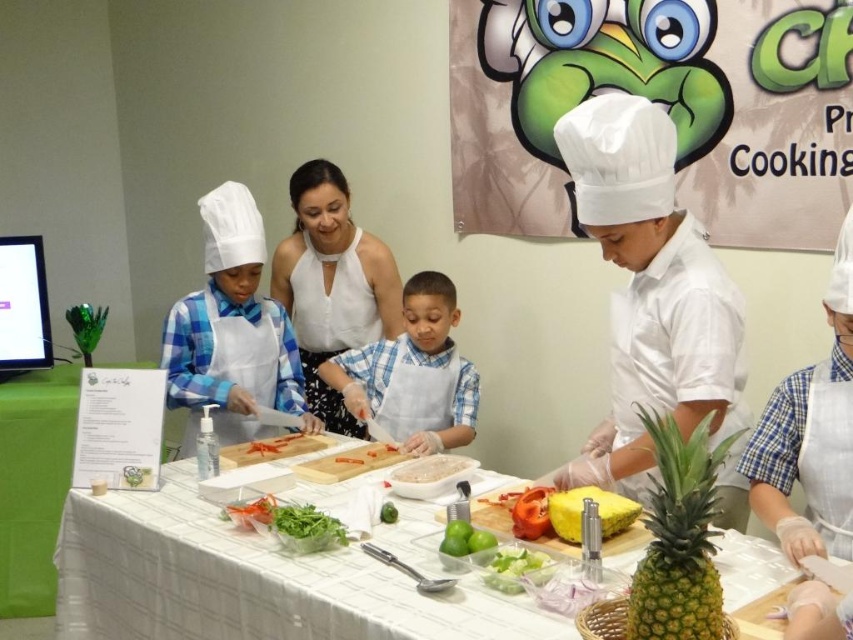
This screenshot has height=640, width=853. What are the coordinates of `white plastic table at center` in the screenshot? It's located at tap(247, 580).

Can you confirm if white plastic table at center is bigger than green textured pineapple at center?

Indeed, white plastic table at center has a larger size compared to green textured pineapple at center.

Is point (265, 624) in front of point (664, 616)?

No, (265, 624) is behind (664, 616).

The width and height of the screenshot is (853, 640). What are the coordinates of `white plastic table at center` in the screenshot? It's located at (247, 580).

Does matte white chef hat at center have a lesser width compared to blue plaid shirt at center?

Yes.

Locate an element on the screen. The width and height of the screenshot is (853, 640). matte white chef hat at center is located at coordinates (231, 332).

I want to click on matte white chef hat at center, so click(x=231, y=332).

Locate an element on the screen. The height and width of the screenshot is (640, 853). matte white chef hat at center is located at coordinates (231, 332).

Can you confirm if white plastic cutting board at center is bigger than translucent plastic bag at center?

Indeed, white plastic cutting board at center has a larger size compared to translucent plastic bag at center.

Can you confirm if white plastic cutting board at center is positioned above translucent plastic bag at center?

Correct, white plastic cutting board at center is located above translucent plastic bag at center.

This screenshot has width=853, height=640. What are the coordinates of `white plastic cutting board at center` in the screenshot? It's located at (431, 468).

The width and height of the screenshot is (853, 640). Find the location of `white plastic cutting board at center`. white plastic cutting board at center is located at coordinates (431, 468).